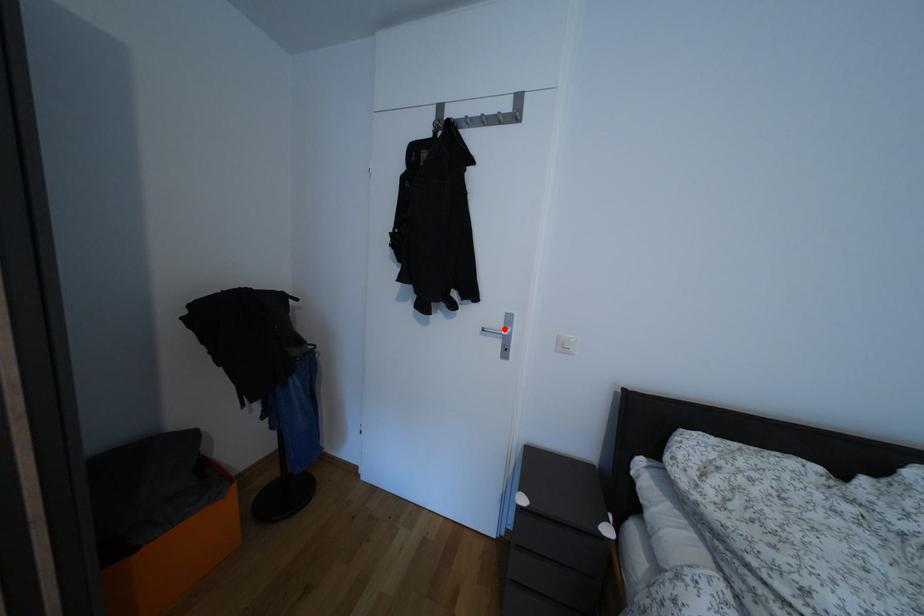
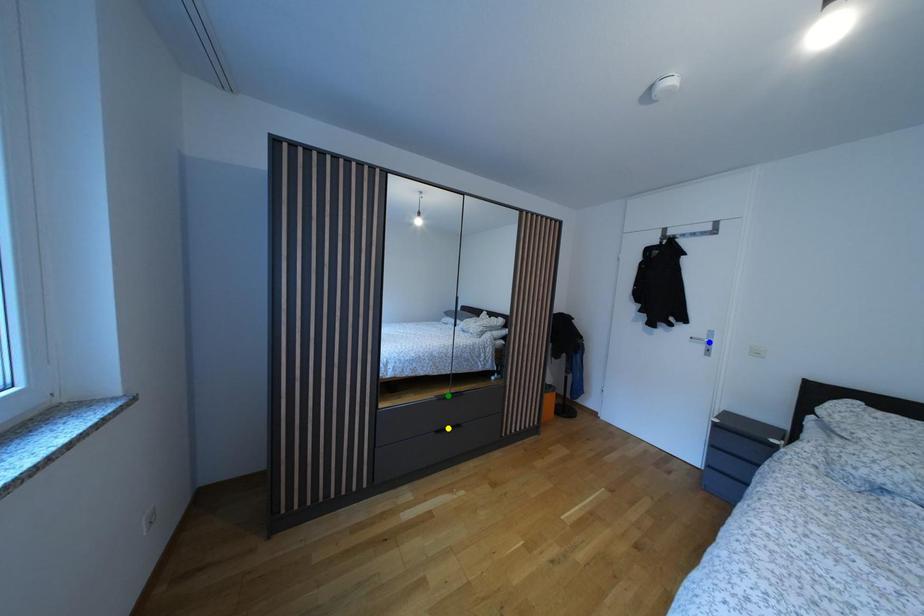
Question: I am providing you with two images of the same scene from different viewpoints. A red point is marked on the first image. You are given multiple points on the second image. Can you choose the point in image 2 that corresponds to the point in image 1?

Choices:
 (A) yellow point
 (B) blue point
 (C) green point

Answer: (B)